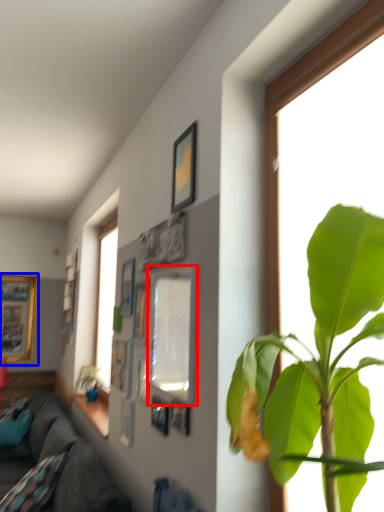
Question: Which object appears closest to the camera in this image, picture frame (highlighted by a red box) or picture frame (highlighted by a blue box)?

Choices:
 (A) picture frame
 (B) picture frame

Answer: (A)